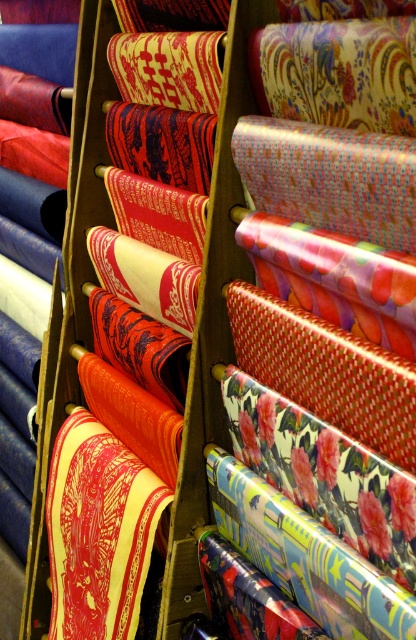
You are standing in front of the fabric rack and want to reach the point at the center of the rack. Which point, point at point (86, 554) or point at (178, 387), is closer to the center of the rack?

Point at point (178, 387) is closer to the center of the rack than point at point (86, 554) because it is positioned in front of it, making it nearer to the center.

You are a tailor trying to decide which fabric to use for a project that requires a wider material. Looking at the image, which fabric between the yellowmattefabric at center and the shiny red fabric at center do you think is wider?

The yellowmattefabric at center might be wider than shiny red fabric at center, so it is possible that the yellowmattefabric at center is the wider option for your project.

You are standing at the point marked as point [111,634] and want to walk to the entrance of the fabric store located at the other end of the rack. The store requires a minimum of 3 feet of space between customers for safety. Can you safely walk to the entrance without violating the safety distance?

The distance between you and the entrance is 4.19 feet, which is more than the required 3 feet, so you can safely walk to the entrance while maintaining the safety distance.